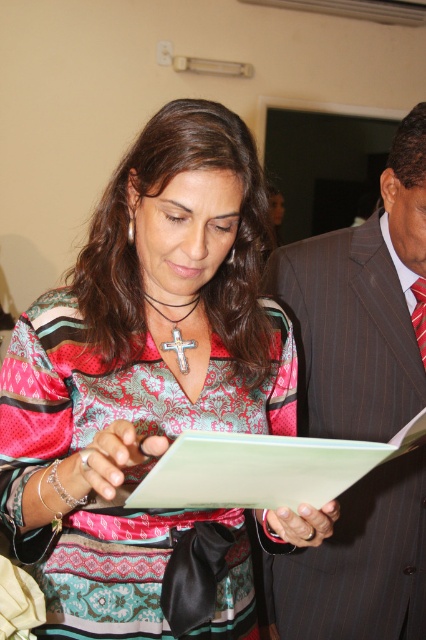
You are a fashion designer observing two clothing items in an image. You need to decide which item is placed lower in the image. The items are the patterned fabric blouse at center and the multicolored woven tie at right. Which one is lower?

The patterned fabric blouse at center is positioned under the multicolored woven tie at right, so the blouse is lower in the image.

You are a photographer trying to capture a candid shot of both the striped suit at center and the multicolored woven tie at right in the same frame. Given that your camera has a focal length of 50mm and a sensor size of 24x36mm, what is the minimum distance you need to stand from the subjects to ensure both are fully in frame?

The minimum distance required is approximately 2.3 meters. This is calculated using the formula for depth of field and sensor dimensions, ensuring both the striped suit at center and multicolored woven tie at right fit within the 50mm focal length and 24x36mm sensor constraints.